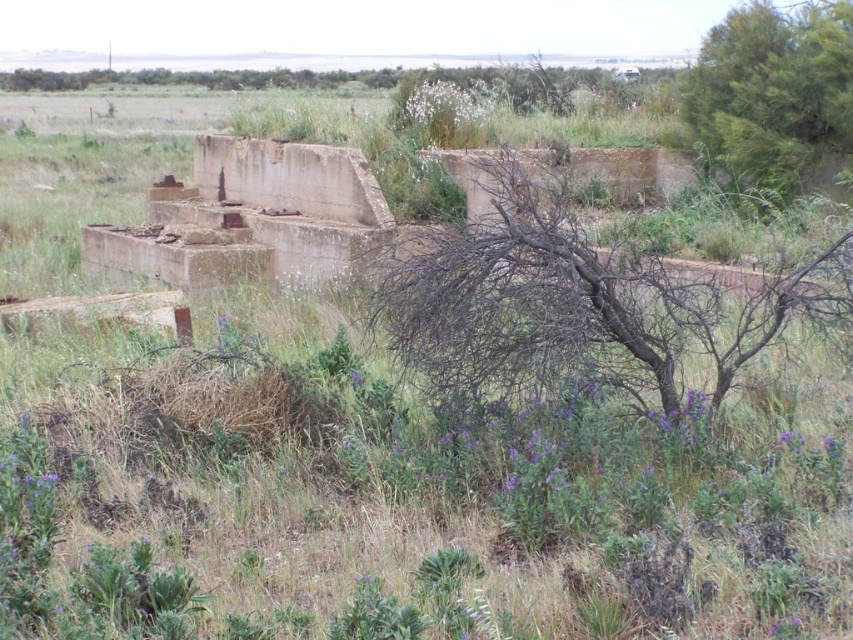
Question: Does brown dry branches at center appear on the left side of green leafy tree at upper right?

Choices:
 (A) no
 (B) yes

Answer: (B)

Question: Which point is farther from the camera taking this photo?

Choices:
 (A) (761, 72)
 (B) (616, 371)

Answer: (A)

Question: From the image, what is the correct spatial relationship of brown dry branches at center in relation to green leafy tree at upper right?

Choices:
 (A) left
 (B) right

Answer: (A)

Question: Which object appears farthest from the camera in this image?

Choices:
 (A) green leafy tree at upper right
 (B) brown dry branches at center

Answer: (A)

Question: Which point is closer to the camera?

Choices:
 (A) green leafy tree at upper right
 (B) brown dry branches at center

Answer: (B)

Question: Is brown dry branches at center to the left of green leafy tree at upper right from the viewer's perspective?

Choices:
 (A) no
 (B) yes

Answer: (B)